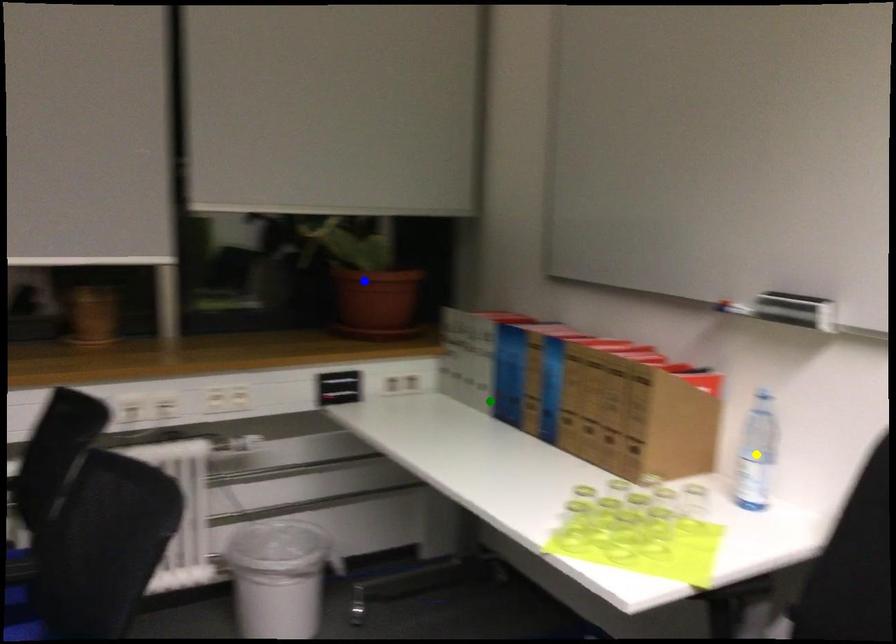
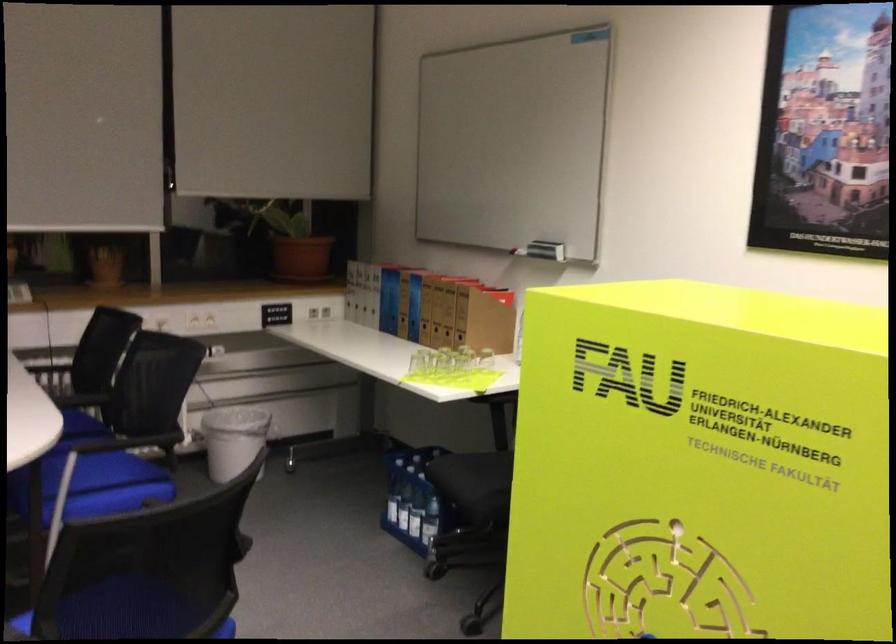
I am providing you with two images of the same scene from different viewpoints. Three points are marked in image1. Which point corresponds to a part or object that is occluded in image2?In image1, three points are marked. Which of them correspond to a part or object that is occluded in image2?Among the three points shown in image1, which one corresponds to a part or object that is no longer visible due to occlusion in image2?

yellow point cannot be seen in image2.